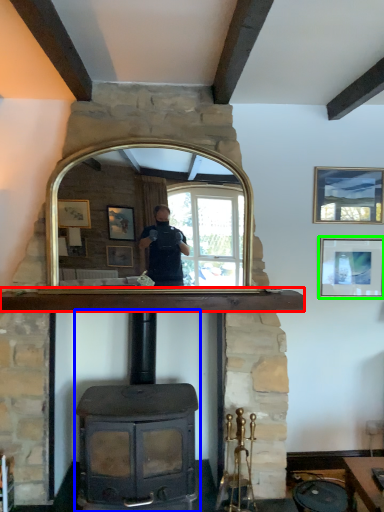
Question: Estimate the real-world distances between objects in this image. Which object is closer to mantle (highlighted by a red box), wood burning stove (highlighted by a blue box) or picture frame (highlighted by a green box)?

Choices:
 (A) wood burning stove
 (B) picture frame

Answer: (A)